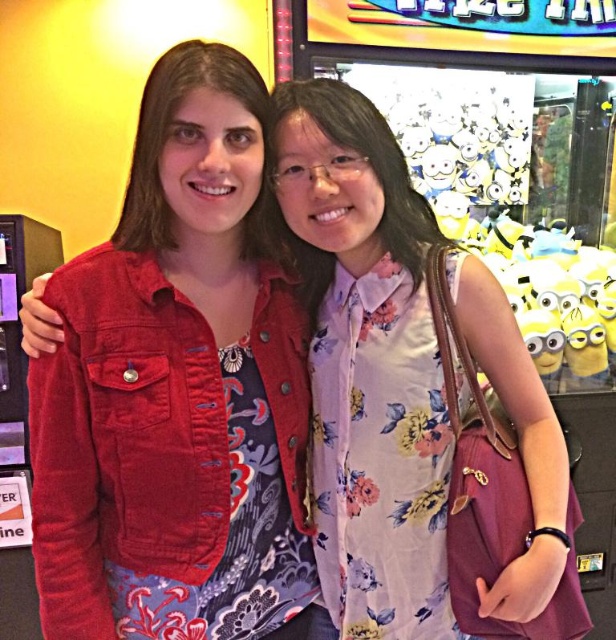
Question: Is matte red jacket at center further to camera compared to floral fabric dress at center?

Choices:
 (A) no
 (B) yes

Answer: (A)

Question: Which object is closer to the camera taking this photo?

Choices:
 (A) floral fabric dress at center
 (B) matte red jacket at center

Answer: (B)

Question: Is matte red jacket at center to the left of floral fabric dress at center from the viewer's perspective?

Choices:
 (A) yes
 (B) no

Answer: (A)

Question: Can you confirm if matte red jacket at center is positioned below floral fabric dress at center?

Choices:
 (A) yes
 (B) no

Answer: (A)